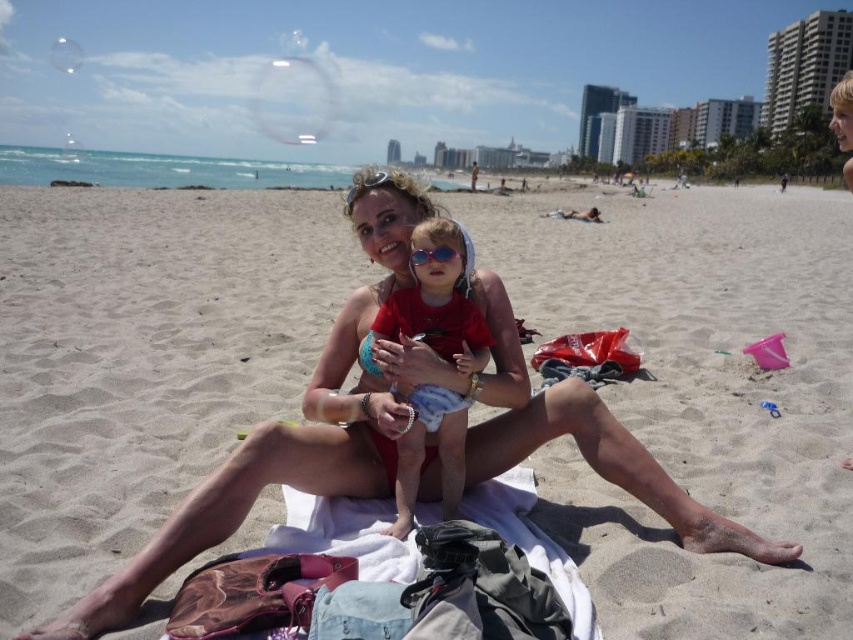
You are a photographer trying to capture the scene of the white sand towel at center and the matte red swimsuit at center. Which object should you focus on first if you want to include both in your shot without moving the camera?

The white sand towel at center is in front of the matte red swimsuit at center, so you should focus on the white sand towel at center first to ensure both are in clear view.

You are a photographer standing at the edge of the beach, and you want to take a photo of the white sand towel at center and the sunglasses at center. If your camera has a zoom lens that can focus up to 10 meters, will you be able to capture both objects clearly without moving closer?

The distance between the white sand towel at center and the sunglasses at center is 8.13 meters. Since the camera can focus up to 10 meters, it can capture both objects clearly without needing to move closer.

You are a photographer trying to capture the perfect shot of the matte red swimsuit at center. Based on the coordinates provided in the scene description, where should you position your camera to ensure the swimsuit is centered in the frame?

The matte red swimsuit at center is located at point (x=437, y=305), so positioning the camera at those coordinates will ensure the swimsuit is centered in the frame.